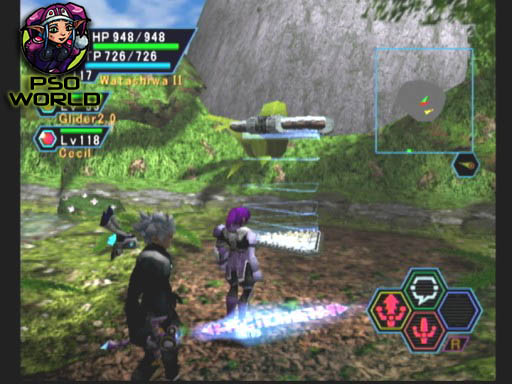
Image resolution: width=512 pixels, height=384 pixels. What are the coordinates of `1 set of white flowers` in the screenshot? It's located at (90, 203).